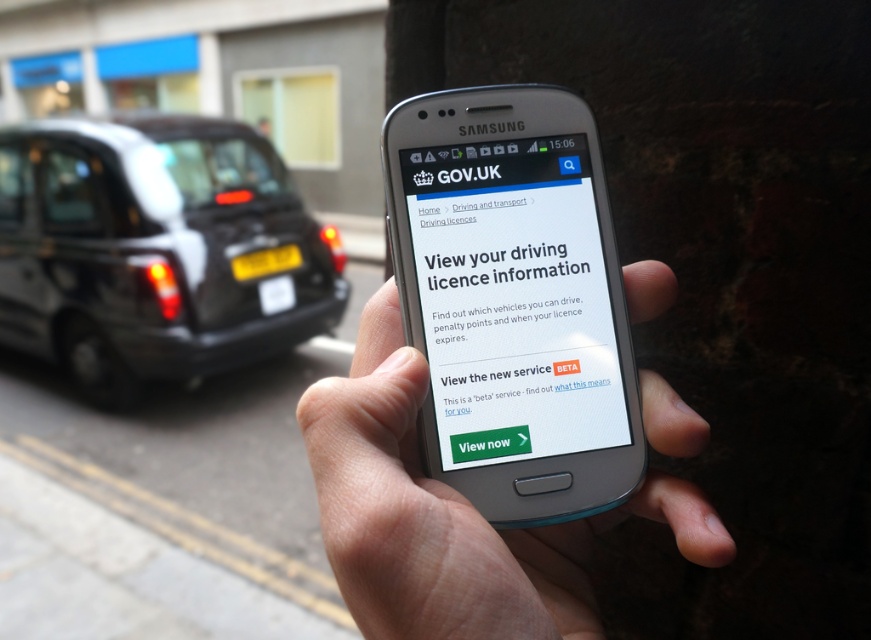
Question: Can you confirm if black metallic taxi at left is smaller than white glossy screen at center?

Choices:
 (A) no
 (B) yes

Answer: (A)

Question: Which point appears farthest from the camera in this image?

Choices:
 (A) (260, 148)
 (B) (383, 634)

Answer: (A)

Question: Observing the image, what is the correct spatial positioning of smooth skin hand at center in reference to white glossy screen at center?

Choices:
 (A) above
 (B) below

Answer: (B)

Question: Is black metallic taxi at left smaller than smooth skin hand at center?

Choices:
 (A) yes
 (B) no

Answer: (B)

Question: Which point appears closest to the camera in this image?

Choices:
 (A) (12, 308)
 (B) (599, 330)
 (C) (385, 556)

Answer: (C)

Question: Which point is farther to the camera?

Choices:
 (A) (368, 403)
 (B) (431, 328)

Answer: (B)